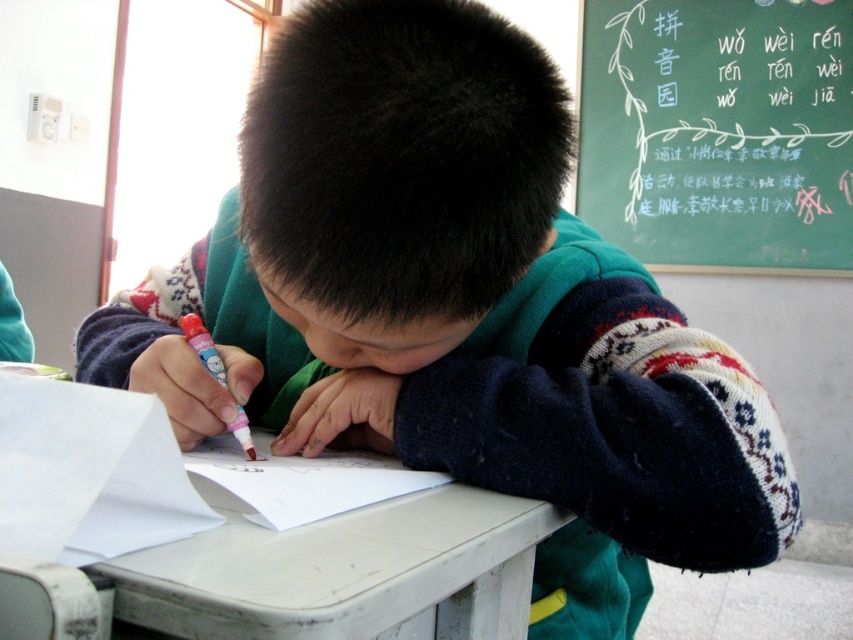
Question: Which object is farther from the camera taking this photo?

Choices:
 (A) white matte table at center
 (B) green chalkboard at upper right
 (C) pink plastic marker at center
 (D) white paper at lower left

Answer: (B)

Question: Which point appears closest to the camera in this image?

Choices:
 (A) pyautogui.click(x=244, y=445)
 (B) pyautogui.click(x=363, y=605)
 (C) pyautogui.click(x=56, y=544)

Answer: (B)

Question: Which point is closer to the camera?

Choices:
 (A) green chalkboard at upper right
 (B) pink plastic marker at center
 (C) white paper at lower left

Answer: (C)

Question: Can you confirm if white matte table at center is thinner than white paper at lower left?

Choices:
 (A) yes
 (B) no

Answer: (B)

Question: Is white matte table at center thinner than white paper at lower left?

Choices:
 (A) yes
 (B) no

Answer: (B)

Question: Is white paper at lower left smaller than pink plastic marker at center?

Choices:
 (A) yes
 (B) no

Answer: (A)